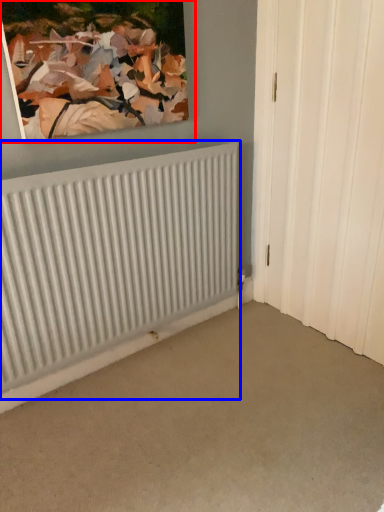
Question: Which of the following is the farthest to the observer, picture frame (highlighted by a red box) or radiator (highlighted by a blue box)?

Choices:
 (A) picture frame
 (B) radiator

Answer: (B)